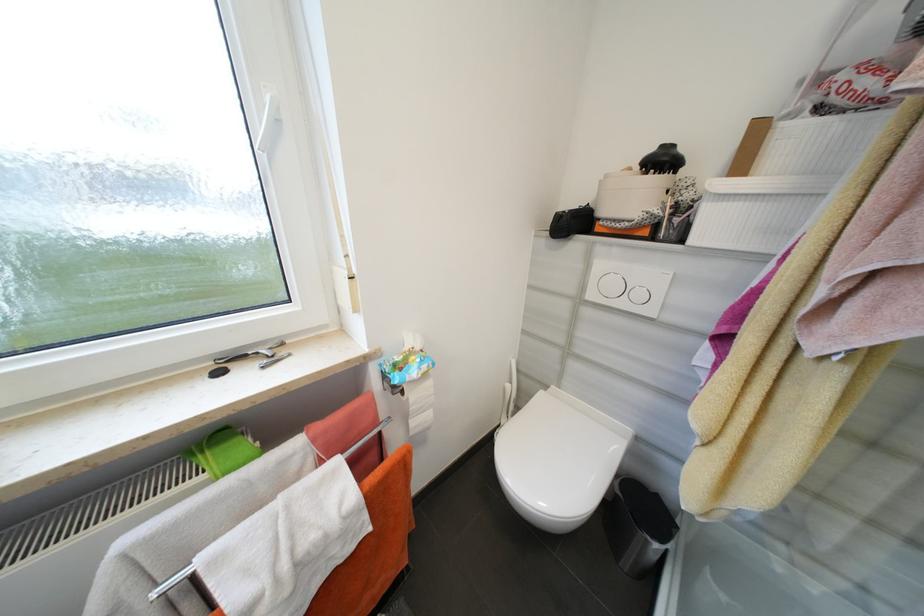
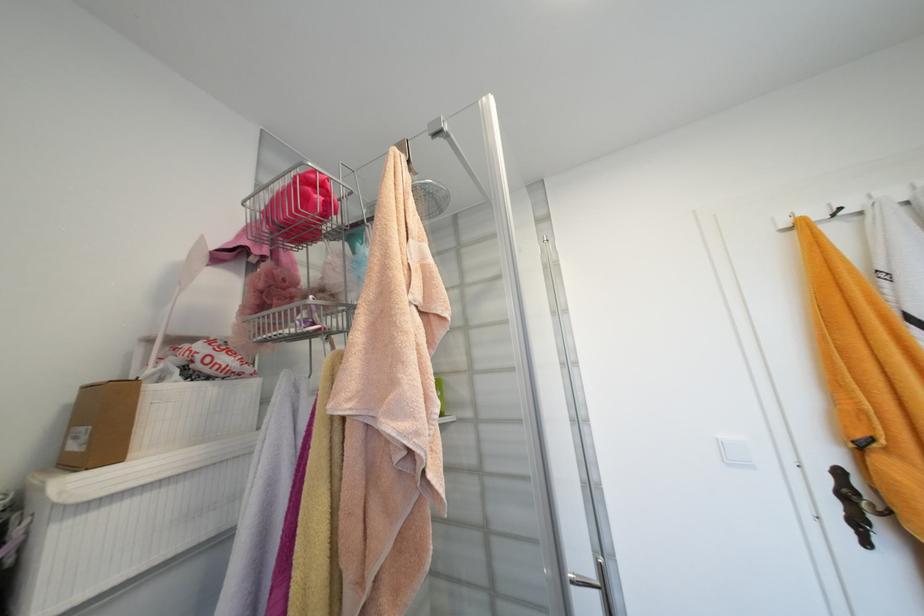
Locate, in the second image, the point that corresponds to (x=855, y=116) in the first image.

(224, 383)